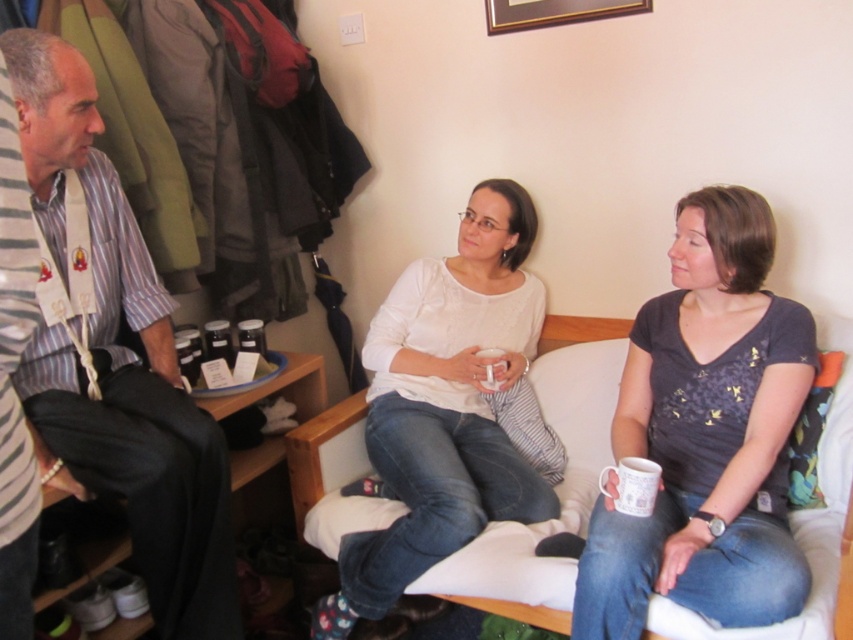
Question: Does matte gray shirt at center appear over white fabric couch at center?

Choices:
 (A) no
 (B) yes

Answer: (B)

Question: Does matte gray shirt at center appear over white fabric couch at center?

Choices:
 (A) yes
 (B) no

Answer: (A)

Question: Which point is farther from the camera taking this photo?

Choices:
 (A) (798, 380)
 (B) (521, 317)
 (C) (572, 384)

Answer: (B)

Question: Which point is closer to the camera?

Choices:
 (A) (136, 228)
 (B) (521, 586)

Answer: (B)

Question: Is white matte shirt at center below white fabric couch at center?

Choices:
 (A) no
 (B) yes

Answer: (A)

Question: Which object appears farthest from the camera in this image?

Choices:
 (A) matte gray shirt at center
 (B) white matte shirt at center
 (C) striped cotton shirt at left

Answer: (B)